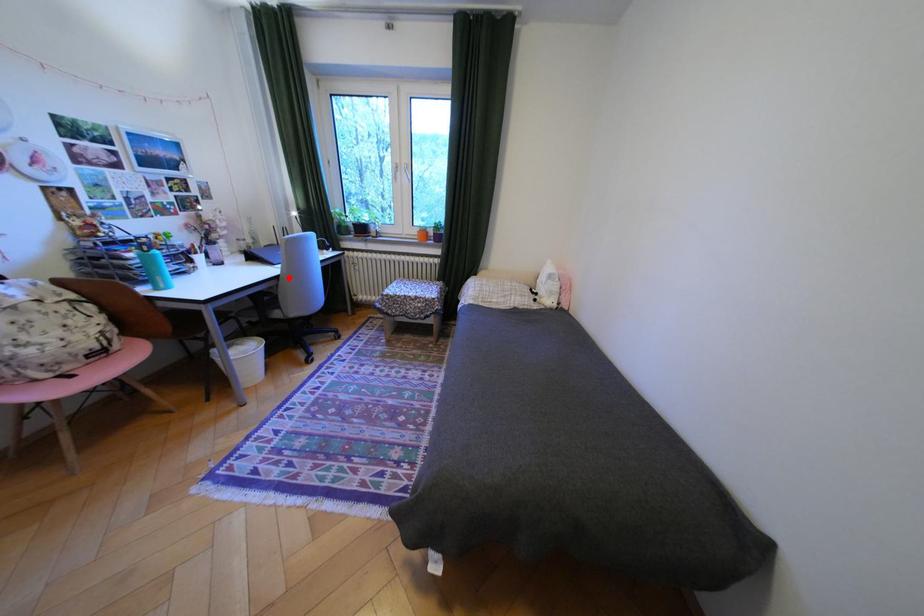
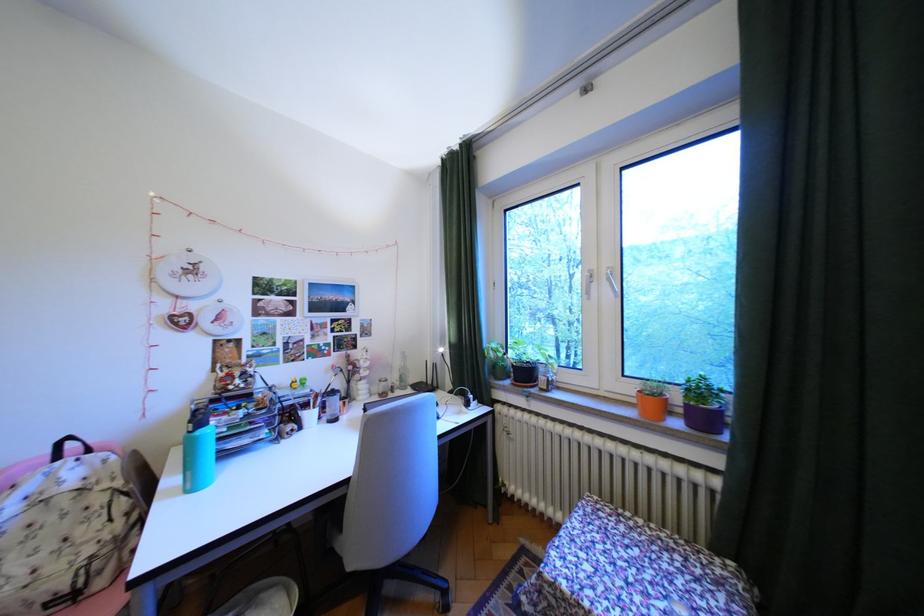
Question: I am providing you with two images of the same scene from different viewpoints. Given a red point in image1, look at the same physical point in image2. Is it:

Choices:
 (A) Closer to the viewpoint
 (B) Farther from the viewpoint

Answer: (B)